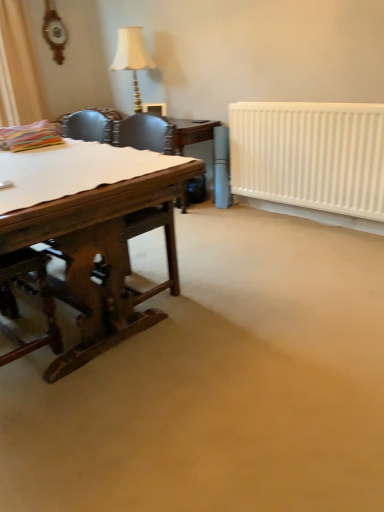
This screenshot has width=384, height=512. Find the location of `matte gold lamp at upper center`. matte gold lamp at upper center is located at coordinates (132, 58).

Where is `white matte radiator at right`? white matte radiator at right is located at coordinates (310, 155).

This screenshot has height=512, width=384. I want to click on matte gold lamp at upper center, so click(132, 58).

Which is behind, point (296, 165) or point (127, 173)?

The point (296, 165) is behind.

Is white matte radiator at right positioned beyond the bounds of white paper at left?

white matte radiator at right is positioned outside white paper at left.

From a real-world perspective, is white matte radiator at right beneath white paper at left?

Indeed, from a real-world perspective, white matte radiator at right is positioned beneath white paper at left.

From the image's perspective, does brown wooden desk at left appear higher than white paper at left?

Actually, brown wooden desk at left appears below white paper at left in the image.

In terms of size, does brown wooden desk at left appear bigger or smaller than white paper at left?

In the image, brown wooden desk at left appears to be larger than white paper at left.

Looking at their sizes, would you say brown wooden desk at left is wider or thinner than white paper at left?

brown wooden desk at left is wider than white paper at left.

Is brown wooden desk at left next to white paper at left and touching it?

They are not placed beside each other.

From a real-world perspective, which object stands above the other?

In real-world perspective, matte gold lamp at upper center is above.

Who is smaller, brown wooden desk at left or matte gold lamp at upper center?

With smaller size is matte gold lamp at upper center.

From the picture: Based on their positions, is brown wooden desk at left located to the left or right of matte gold lamp at upper center?

Based on their positions, brown wooden desk at left is located to the left of matte gold lamp at upper center.

Considering the sizes of objects brown wooden desk at left and matte gold lamp at upper center in the image provided, who is thinner, brown wooden desk at left or matte gold lamp at upper center?

matte gold lamp at upper center.

From the picture: Which object is more forward, brown wooden desk at left or white matte radiator at right?

brown wooden desk at left is closer to the camera.

Is brown wooden desk at left in contact with white matte radiator at right?

brown wooden desk at left and white matte radiator at right are not in contact.

In order to click on desk lying below the white matte radiator at right (from the image's perspective) in this screenshot , I will do `click(91, 231)`.

How many degrees apart are the facing directions of brown wooden desk at left and white matte radiator at right?

The facing directions of brown wooden desk at left and white matte radiator at right are 89.1 degrees apart.

Is matte gold lamp at upper center looking in the opposite direction of brown wooden desk at left?

No, matte gold lamp at upper center is not facing away from brown wooden desk at left.

Is matte gold lamp at upper center bigger or smaller than brown wooden desk at left?

matte gold lamp at upper center is smaller than brown wooden desk at left.

Find the location of a particular element. Image resolution: width=384 pixels, height=512 pixels. lamp located behind the brown wooden desk at left is located at coordinates (132, 58).

Is matte gold lamp at upper center to the right of brown wooden desk at left from the viewer's perspective?

Indeed, matte gold lamp at upper center is positioned on the right side of brown wooden desk at left.

Based on the photo, from the image's perspective, is white paper at left on top of matte gold lamp at upper center?

No, from the image's perspective, white paper at left is not on top of matte gold lamp at upper center.

Does point (34, 172) appear closer or farther from the camera than point (141, 38)?

Point (34, 172) is closer to the camera than point (141, 38).

Considering the positions of objects white paper at left and matte gold lamp at upper center in the image provided, who is more to the left, white paper at left or matte gold lamp at upper center?

white paper at left.

From the image's perspective, would you say white paper at left is positioned over brown wooden desk at left?

Correct, white paper at left appears higher than brown wooden desk at left in the image.

Locate an element on the screen. desk below the white paper at left (from the image's perspective) is located at coordinates (91, 231).

Looking at this image, between white paper at left and brown wooden desk at left, which one appears on the right side from the viewer's perspective?

white paper at left.

Would you say white paper at left is outside brown wooden desk at left?

Actually, white paper at left is at least partially inside brown wooden desk at left.

Where is `radiator on the right side of white paper at left`? This screenshot has height=512, width=384. radiator on the right side of white paper at left is located at coordinates (310, 155).

Where is `desk on the left of the white paper at left`? The image size is (384, 512). desk on the left of the white paper at left is located at coordinates (91, 231).

Which object lies further to the anchor point white matte radiator at right, matte gold lamp at upper center or white paper at left?

matte gold lamp at upper center.

From the image, which object appears to be farther from brown wooden desk at left, white paper at left or matte gold lamp at upper center?

matte gold lamp at upper center is positioned further to the anchor brown wooden desk at left.

Considering their positions, is matte gold lamp at upper center positioned further to white matte radiator at right than brown wooden desk at left?

brown wooden desk at left is positioned further to the anchor white matte radiator at right.

Estimate the real-world distances between objects in this image. Which object is further from brown wooden desk at left, white paper at left or white matte radiator at right?

white matte radiator at right.

From the image, which object appears to be farther from brown wooden desk at left, white matte radiator at right or matte gold lamp at upper center?

matte gold lamp at upper center lies further to brown wooden desk at left than the other object.

Which object lies nearer to the anchor point matte gold lamp at upper center, brown wooden desk at left or white matte radiator at right?

The object closer to matte gold lamp at upper center is white matte radiator at right.

Considering their positions, is white matte radiator at right positioned further to brown wooden desk at left than white paper at left?

The object further to brown wooden desk at left is white matte radiator at right.

Estimate the real-world distances between objects in this image. Which object is further from white matte radiator at right, brown wooden desk at left or matte gold lamp at upper center?

Based on the image, brown wooden desk at left appears to be further to white matte radiator at right.

At what (x,y) coordinates should I click in order to perform the action: click on radiator between white paper at left and matte gold lamp at upper center from front to back. Please return your answer as a coordinate pair (x, y). Looking at the image, I should click on (310, 155).

I want to click on sheet positioned between brown wooden desk at left and matte gold lamp at upper center from near to far, so click(x=74, y=170).

Identify the location of sheet between brown wooden desk at left and white matte radiator at right from left to right. (74, 170).

Identify the location of radiator positioned between brown wooden desk at left and matte gold lamp at upper center from near to far. This screenshot has height=512, width=384. (310, 155).